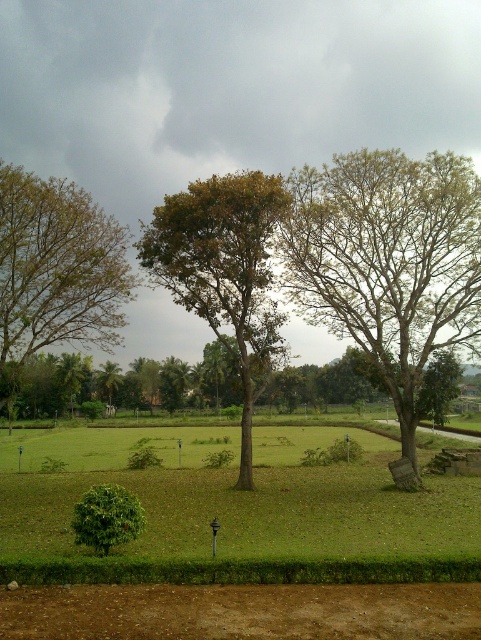
Based on the photo, you are standing in the serene outdoor scene and want to walk from point A to point B. Point A is at coordinates point (291, 228) and point B is at coordinates point (190, 211). Which direction should you move to get closer to point B?

To move from point A at (291, 228) to point B at (190, 211), you should move downward and slightly to the left since point A is further away from the viewer compared to point B.

You are a bird looking for a nesting spot. You see the green leafy tree at right and the brown leafy tree at upper left. Which tree is taller and would provide a better vantage point?

The green leafy tree at right is taller than the brown leafy tree at upper left, so it would provide a better vantage point.

You are planning to plant a new tree in this area and want to ensure it has enough space. Given the current trees, which tree would require more horizontal space for its branches? Please refer to the green leafy tree at right and the brown leafy tree at upper left.

The brown leafy tree at upper left requires more horizontal space because it has a greater width compared to the green leafy tree at right.